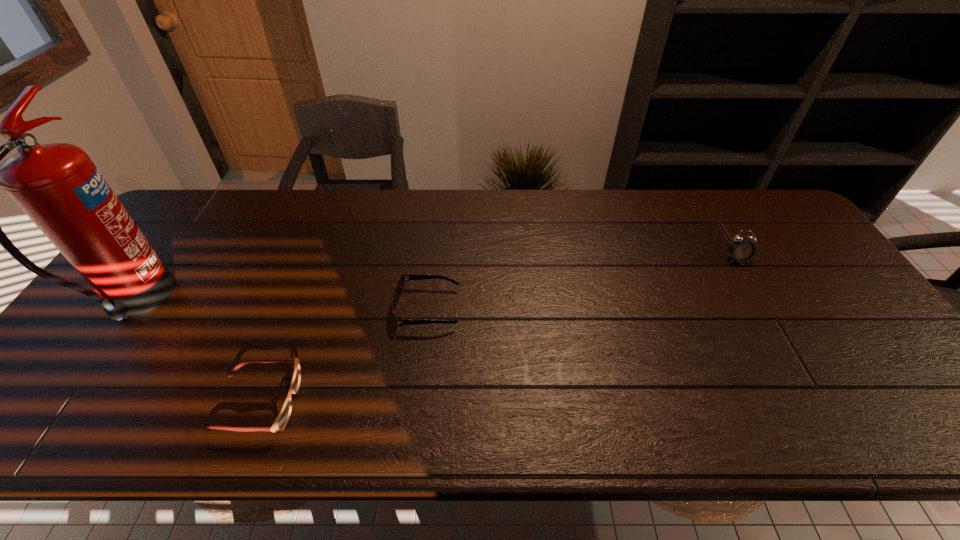
Locate an element on the screen. Image resolution: width=960 pixels, height=540 pixels. vacant space located on the front-facing side of the spectacles is located at coordinates (429, 403).

Image resolution: width=960 pixels, height=540 pixels. Find the location of `object that is positioned at the near edge`. object that is positioned at the near edge is located at coordinates (281, 421).

Identify the location of object situated at the left edge. (58, 186).

I want to click on blank space at the far edge, so [387, 194].

Where is `vacant space at the near edge`? vacant space at the near edge is located at coordinates (581, 411).

In the image, there is a desktop. Identify the location of vacant space at the left edge. This screenshot has height=540, width=960. (181, 255).

Locate an element on the screen. This screenshot has height=540, width=960. vacant space at the far left corner of the desktop is located at coordinates coord(198,217).

This screenshot has height=540, width=960. I want to click on vacant space at the far right corner, so click(x=775, y=234).

The image size is (960, 540). I want to click on vacant region between the tallest object and the sunglasses, so click(x=282, y=306).

Locate an element on the screen. free point between the second tallest object and the spectacles is located at coordinates (497, 331).